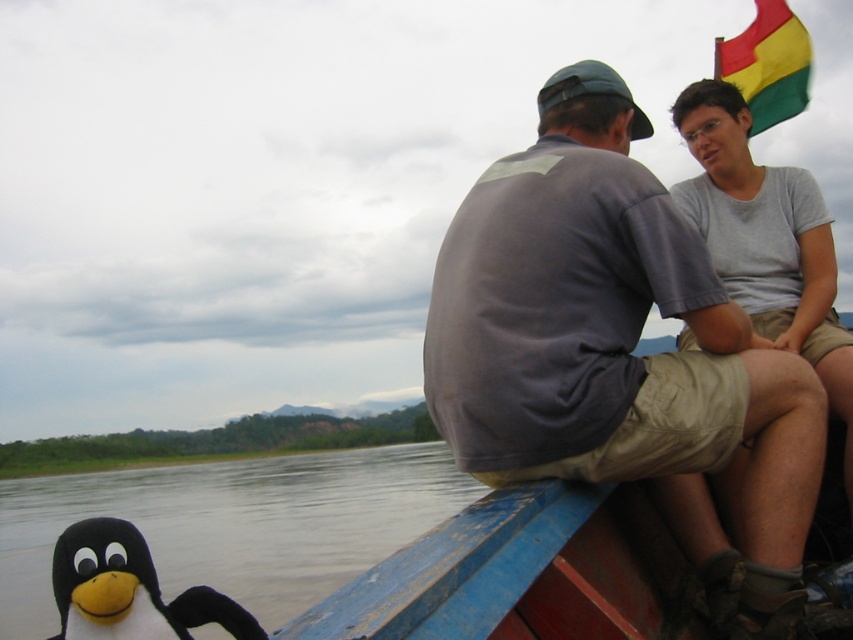
You are standing in front of the boat scene and want to know which of the two points, point (798, 506) or point (67, 516), is closer to you. Can you determine this based on the image?

Point (798, 506) is closer to the viewer than point (67, 516).